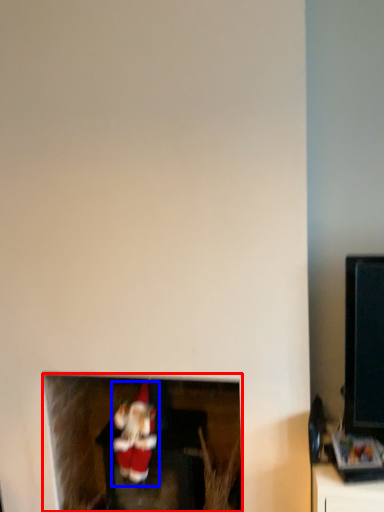
Question: Which object is closer to the camera taking this photo, fireplace (highlighted by a red box) or santa claus (highlighted by a blue box)?

Choices:
 (A) fireplace
 (B) santa claus

Answer: (B)